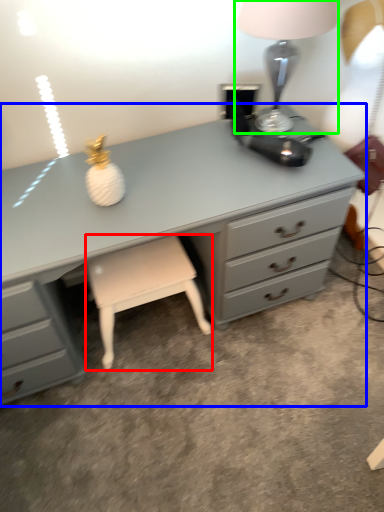
Question: Which is farther away from stool (highlighted by a red box)? chest of drawers (highlighted by a blue box) or table lamp (highlighted by a green box)?

Choices:
 (A) chest of drawers
 (B) table lamp

Answer: (B)